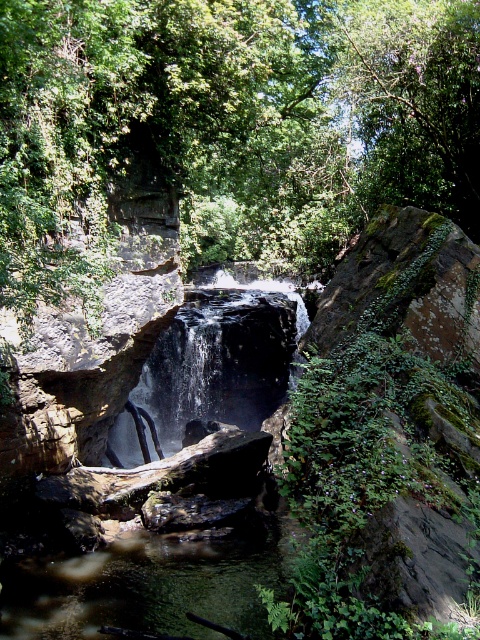
You are standing at the edge of the waterfall and see the green leafy tree at center and the clear water at center. Which object is located to the right of the other?

The green leafy tree at center is positioned on the right side of clear water at center.

You are a hiker who wants to cross from the green leafy tree at center to the clear water at center. Can you safely walk directly between them without any obstacles?

The distance between the green leafy tree at center and clear water at center is 6.44 meters. Since there are no obstacles mentioned in the scene description, you can safely walk directly between them.

You are standing at the base of the waterfall and see the green leafy tree at center and the green leafy tree at upper center. Which tree is closer to you?

The green leafy tree at center is closer to you because it is positioned under the green leafy tree at upper center.